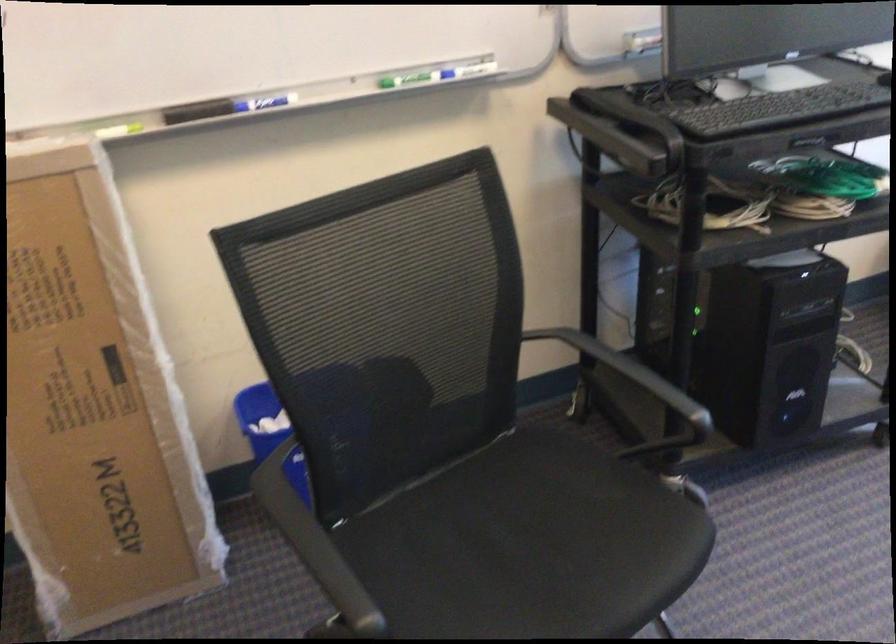
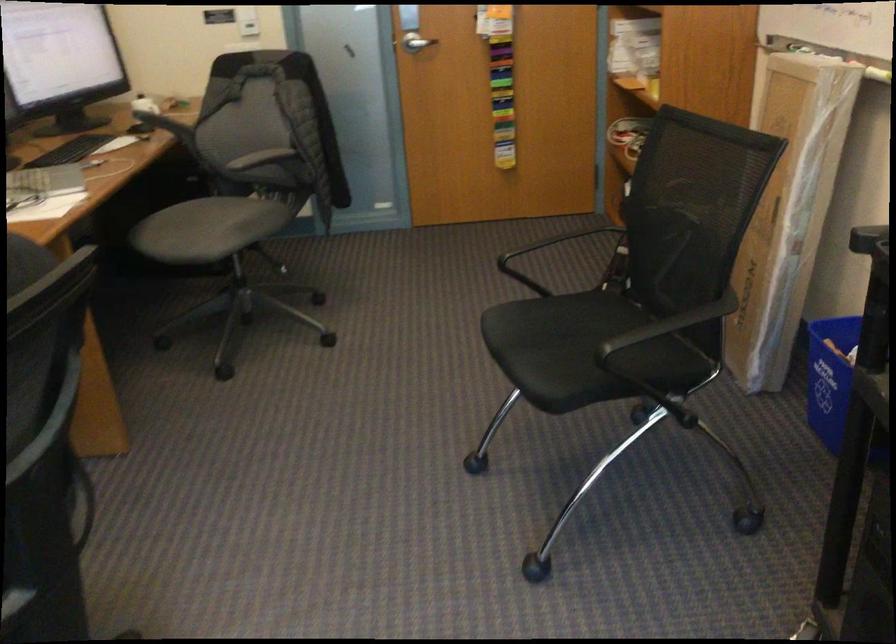
Question: I am providing you with two images of the same scene from different viewpoints. Which of the following objects are not visible in image2?

Choices:
 (A) black chair armrest
 (B) shower curtain ring
 (C) black chair sitting surface
 (D) cardboard box

Answer: (A)